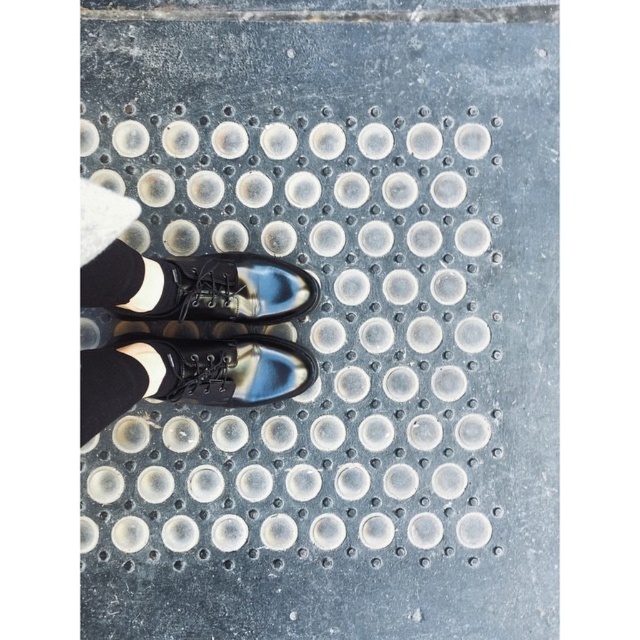
Which is more to the left, black leather shoes at center or black leather shoe at center?

Positioned to the left is black leather shoes at center.

Does black leather shoes at center have a larger size compared to black leather shoe at center?

Yes, black leather shoes at center is bigger than black leather shoe at center.

Locate an element on the screen. This screenshot has height=640, width=640. black leather shoes at center is located at coordinates (180, 275).

Who is taller, black leather shoes at center or shiny black shoes at center?

With more height is black leather shoes at center.

Is black leather shoes at center above shiny black shoes at center?

Correct, black leather shoes at center is located above shiny black shoes at center.

Image resolution: width=640 pixels, height=640 pixels. What do you see at coordinates (180, 275) in the screenshot? I see `black leather shoes at center` at bounding box center [180, 275].

What are the coordinates of `black leather shoes at center` in the screenshot? It's located at (180, 275).

Is black leather shoe at center thinner than black wool sock at lower left?

No, black leather shoe at center is not thinner than black wool sock at lower left.

Consider the image. Does black leather shoe at center lie in front of black wool sock at lower left?

No, it is not.

I want to click on black leather shoe at center, so click(x=225, y=289).

The image size is (640, 640). Identify the location of black leather shoe at center. (225, 289).